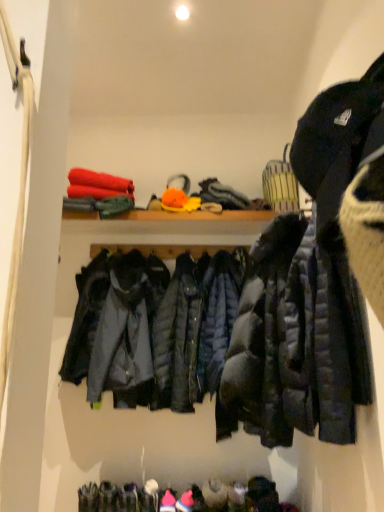
What is the approximate height of matte black puffer jacket at right, marked as the 1th jacket in a front-to-back arrangement?

It is 94.14 centimeters.

Describe the element at coordinates (296, 342) in the screenshot. The width and height of the screenshot is (384, 512). I see `matte black puffer jacket at right, which is counted as the second jacket, starting from the back` at that location.

Image resolution: width=384 pixels, height=512 pixels. Identify the location of matte black puffer jacket at right, which ranks as the first jacket in right-to-left order. (296, 342).

Measure the distance between matte black puffer jacket at right, which is the second jacket in left-to-right order, and camera.

matte black puffer jacket at right, which is the second jacket in left-to-right order, is 3.41 feet from camera.

How much space does matte black jacket at center, placed as the first jacket when sorted from back to front, occupy horizontally?

It is 16.09 inches.

The image size is (384, 512). I want to click on matte black jacket at center, placed as the 2th jacket when sorted from front to back, so click(153, 329).

Describe the element at coordinates (153, 329) in the screenshot. The image size is (384, 512). I see `matte black jacket at center, placed as the 2th jacket when sorted from front to back` at that location.

In order to click on matte black puffer jacket at right, marked as the 1th jacket in a front-to-back arrangement in this screenshot , I will do `click(296, 342)`.

Considering the relative positions of matte black puffer jacket at right, which is counted as the second jacket, starting from the back, and matte black jacket at center, which is the 2th jacket from right to left, in the image provided, is matte black puffer jacket at right, which is counted as the second jacket, starting from the back, to the right of matte black jacket at center, which is the 2th jacket from right to left, from the viewer's perspective?

Correct, you'll find matte black puffer jacket at right, which is counted as the second jacket, starting from the back, to the right of matte black jacket at center, which is the 2th jacket from right to left.

Which object is further away from the camera taking this photo, matte black puffer jacket at right, which ranks as the first jacket in right-to-left order, or matte black jacket at center, placed as the first jacket when sorted from back to front?

Positioned behind is matte black jacket at center, placed as the first jacket when sorted from back to front.

Which is closer, (278, 344) or (113, 273)?

Clearly, point (278, 344) is closer to the camera than point (113, 273).

From the image's perspective, which object appears higher, matte black puffer jacket at right, which is counted as the second jacket, starting from the back, or matte black jacket at center, placed as the first jacket when sorted from back to front?

From the image's view, matte black puffer jacket at right, which is counted as the second jacket, starting from the back, is above.

From a real-world perspective, who is located higher, matte black puffer jacket at right, marked as the 1th jacket in a front-to-back arrangement, or matte black jacket at center, placed as the 2th jacket when sorted from front to back?

matte black puffer jacket at right, marked as the 1th jacket in a front-to-back arrangement, is physically above.

Can you confirm if matte black puffer jacket at right, which is the second jacket in left-to-right order, is wider than matte black jacket at center, placed as the 2th jacket when sorted from front to back?

Correct, the width of matte black puffer jacket at right, which is the second jacket in left-to-right order, exceeds that of matte black jacket at center, placed as the 2th jacket when sorted from front to back.

Which of these two, matte black puffer jacket at right, marked as the 1th jacket in a front-to-back arrangement, or matte black jacket at center, the 1th jacket from the left, stands shorter?

With less height is matte black jacket at center, the 1th jacket from the left.

Considering the sizes of matte black puffer jacket at right, which is the second jacket in left-to-right order, and matte black jacket at center, placed as the first jacket when sorted from back to front, in the image, is matte black puffer jacket at right, which is the second jacket in left-to-right order, bigger or smaller than matte black jacket at center, placed as the first jacket when sorted from back to front,?

In the image, matte black puffer jacket at right, which is the second jacket in left-to-right order, appears to be larger than matte black jacket at center, placed as the first jacket when sorted from back to front.

Choose the correct answer: Is matte black puffer jacket at right, which ranks as the first jacket in right-to-left order, inside matte black jacket at center, which is the 2th jacket from right to left, or outside it?

matte black puffer jacket at right, which ranks as the first jacket in right-to-left order, lies outside matte black jacket at center, which is the 2th jacket from right to left.

Is the surface of matte black puffer jacket at right, which is counted as the second jacket, starting from the back, in direct contact with matte black jacket at center, placed as the first jacket when sorted from back to front?

There is a gap between matte black puffer jacket at right, which is counted as the second jacket, starting from the back, and matte black jacket at center, placed as the first jacket when sorted from back to front.

Is matte black puffer jacket at right, which is the second jacket in left-to-right order, facing away from matte black jacket at center, the 1th jacket from the left?

matte black puffer jacket at right, which is the second jacket in left-to-right order, is not turned away from matte black jacket at center, the 1th jacket from the left.

What's the angular difference between matte black puffer jacket at right, marked as the 1th jacket in a front-to-back arrangement, and matte black jacket at center, which is the 2th jacket from right to left,'s facing directions?

The facing directions of matte black puffer jacket at right, marked as the 1th jacket in a front-to-back arrangement, and matte black jacket at center, which is the 2th jacket from right to left, are 93 degrees apart.

Locate an element on the screen. Image resolution: width=384 pixels, height=512 pixels. jacket behind the matte black puffer jacket at right, marked as the 1th jacket in a front-to-back arrangement is located at coordinates (153, 329).

Which is more to the right, matte black jacket at center, placed as the first jacket when sorted from back to front, or matte black puffer jacket at right, marked as the 1th jacket in a front-to-back arrangement?

matte black puffer jacket at right, marked as the 1th jacket in a front-to-back arrangement, is more to the right.

Which is in front, matte black jacket at center, the 1th jacket from the left, or matte black puffer jacket at right, which is counted as the second jacket, starting from the back?

matte black puffer jacket at right, which is counted as the second jacket, starting from the back.

Which is nearer, (159, 298) or (284, 277)?

Point (284, 277)

From the image's perspective, does matte black jacket at center, placed as the 2th jacket when sorted from front to back, appear higher than matte black puffer jacket at right, marked as the 1th jacket in a front-to-back arrangement?

Actually, matte black jacket at center, placed as the 2th jacket when sorted from front to back, appears below matte black puffer jacket at right, marked as the 1th jacket in a front-to-back arrangement, in the image.

From a real-world perspective, which object rests below the other?

matte black jacket at center, the 1th jacket from the left, from a real-world perspective.

Considering the relative sizes of matte black jacket at center, placed as the 2th jacket when sorted from front to back, and matte black puffer jacket at right, marked as the 1th jacket in a front-to-back arrangement, in the image provided, is matte black jacket at center, placed as the 2th jacket when sorted from front to back, wider than matte black puffer jacket at right, marked as the 1th jacket in a front-to-back arrangement,?

In fact, matte black jacket at center, placed as the 2th jacket when sorted from front to back, might be narrower than matte black puffer jacket at right, marked as the 1th jacket in a front-to-back arrangement.

Does matte black jacket at center, the 1th jacket from the left, have a greater height compared to matte black puffer jacket at right, marked as the 1th jacket in a front-to-back arrangement?

Incorrect, the height of matte black jacket at center, the 1th jacket from the left, is not larger of that of matte black puffer jacket at right, marked as the 1th jacket in a front-to-back arrangement.

Is matte black jacket at center, which is the 2th jacket from right to left, smaller than matte black puffer jacket at right, which ranks as the first jacket in right-to-left order?

Correct, matte black jacket at center, which is the 2th jacket from right to left, occupies less space than matte black puffer jacket at right, which ranks as the first jacket in right-to-left order.

Is matte black jacket at center, placed as the first jacket when sorted from back to front, inside the boundaries of matte black puffer jacket at right, marked as the 1th jacket in a front-to-back arrangement, or outside?

matte black jacket at center, placed as the first jacket when sorted from back to front, is not inside matte black puffer jacket at right, marked as the 1th jacket in a front-to-back arrangement, it's outside.

Is there a large distance between matte black jacket at center, which is the 2th jacket from right to left, and matte black puffer jacket at right, which is the second jacket in left-to-right order?

No, matte black jacket at center, which is the 2th jacket from right to left, is not far from matte black puffer jacket at right, which is the second jacket in left-to-right order.

Is matte black jacket at center, placed as the first jacket when sorted from back to front, aimed at matte black puffer jacket at right, which ranks as the first jacket in right-to-left order?

No.

How much distance is there between matte black jacket at center, which is the 2th jacket from right to left, and matte black puffer jacket at right, marked as the 1th jacket in a front-to-back arrangement?

matte black jacket at center, which is the 2th jacket from right to left, and matte black puffer jacket at right, marked as the 1th jacket in a front-to-back arrangement, are 30.43 inches apart.

The image size is (384, 512). Identify the location of jacket above the matte black jacket at center, placed as the first jacket when sorted from back to front (from the image's perspective). (296, 342).

Identify the location of jacket behind the matte black puffer jacket at right, which is counted as the second jacket, starting from the back. The image size is (384, 512). (153, 329).

Identify the location of jacket below the matte black puffer jacket at right, which is counted as the second jacket, starting from the back (from a real-world perspective). (153, 329).